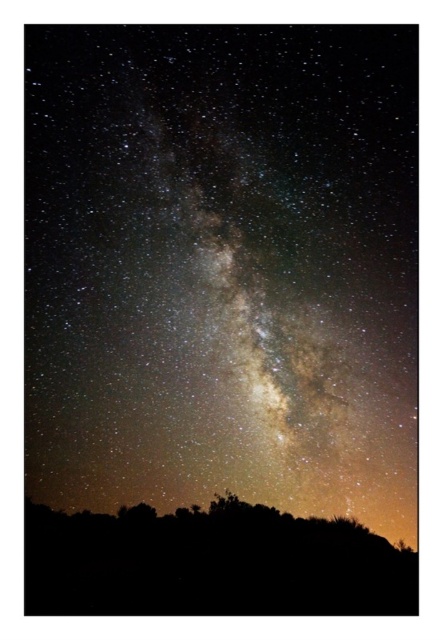
You are an astronomer standing in a dark field and want to observe the Milky Way. Based on the image, how far apart are the milky way at center and the silhouette vegetation at lower center?

The milky way at center and silhouette vegetation at lower center are 52.40 meters apart from each other.

You are an astronomer analyzing the night sky image. The Milky Way is the central band of stars. What are the coordinates of the Milky Way at center in the image?

The Milky Way at center is located at coordinates point (222, 266).